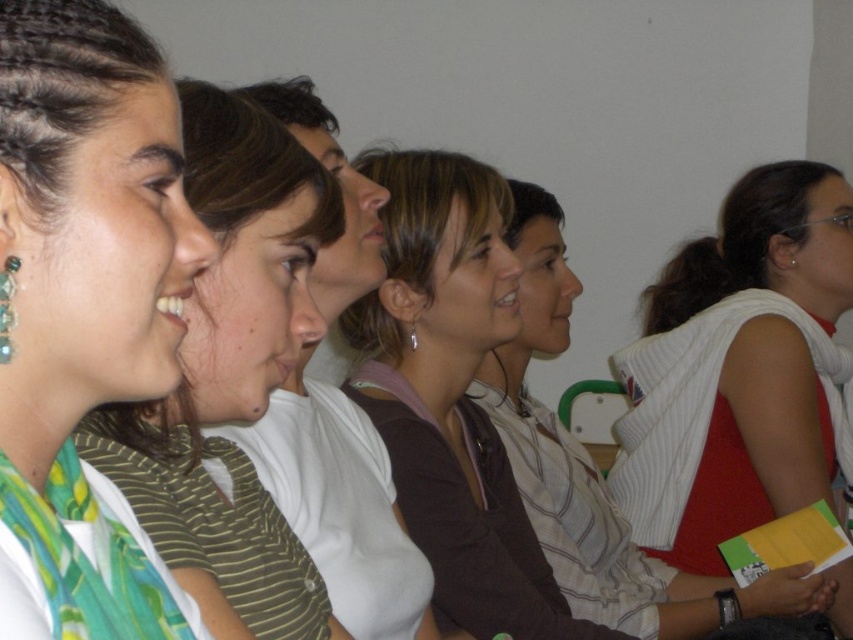
Question: Can you confirm if green silk scarf at left is smaller than white knit vest at center-right?

Choices:
 (A) yes
 (B) no

Answer: (A)

Question: Which point is farther from the camera taking this photo?

Choices:
 (A) (529, 512)
 (B) (399, 500)

Answer: (A)

Question: Which of the following is the farthest from the observer?

Choices:
 (A) (4, 49)
 (B) (433, 413)
 (C) (224, 573)
 (D) (552, 484)

Answer: (D)

Question: Does green striped shirt at left have a lesser width compared to white knit vest at center-right?

Choices:
 (A) yes
 (B) no

Answer: (A)

Question: Which point is closer to the camera?

Choices:
 (A) (567, 321)
 (B) (55, 429)

Answer: (B)

Question: Does white knit vest at center-right have a lesser width compared to brown matte shirt at center?

Choices:
 (A) no
 (B) yes

Answer: (A)